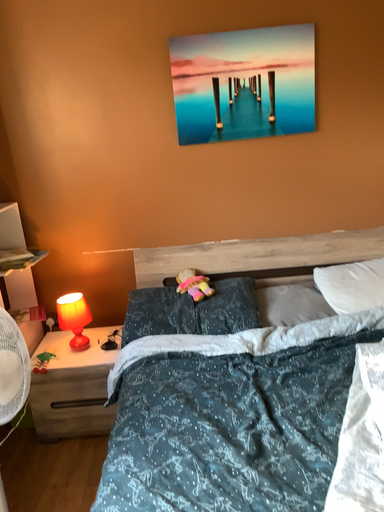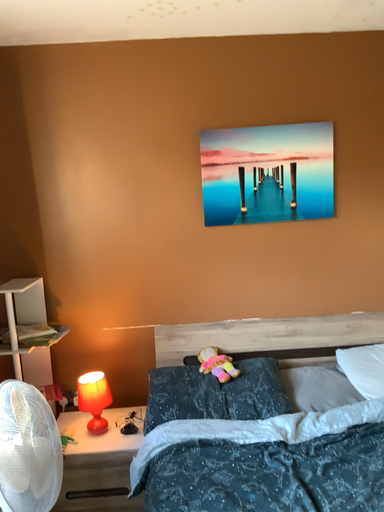
Question: Which way did the camera rotate in the video?

Choices:
 (A) rotated upward
 (B) rotated downward

Answer: (A)